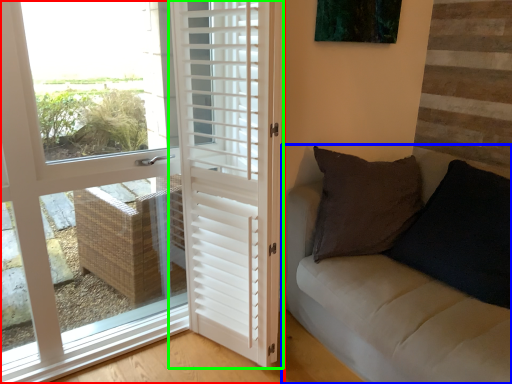
Question: Which is nearer to the door (highlighted by a red box)? studio couch (highlighted by a blue box) or door (highlighted by a green box).

Choices:
 (A) studio couch
 (B) door

Answer: (B)